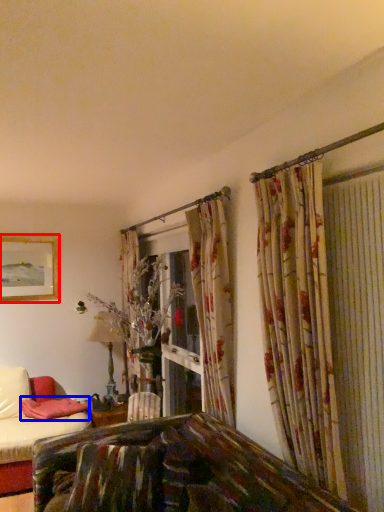
Question: Which point is closer to the camera, picture frame (highlighted by a red box) or pillow (highlighted by a blue box)?

Choices:
 (A) picture frame
 (B) pillow

Answer: (B)